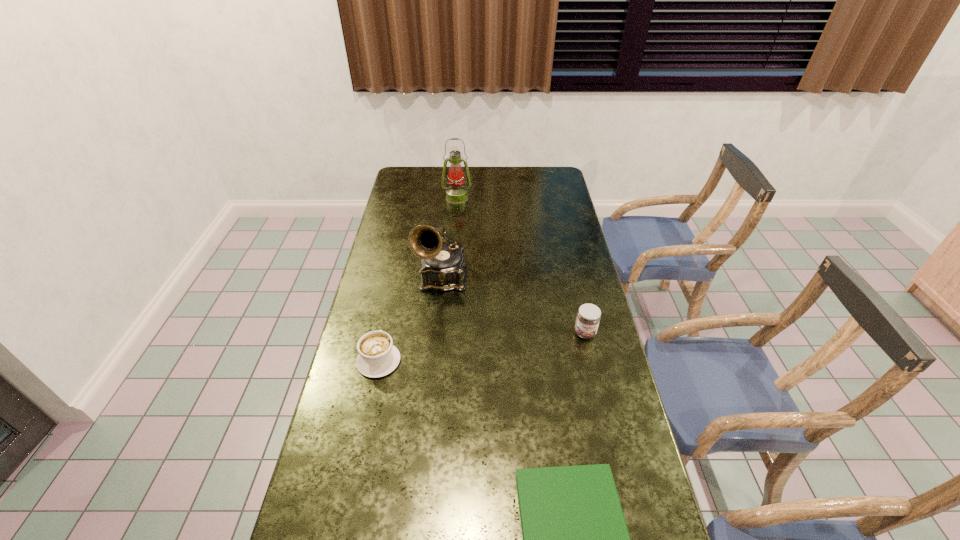
In order to click on free spot between the jam and the fourth nearest object in this screenshot , I will do 514,305.

Find the location of a particular element. free space between the jam and the oil lamp is located at coordinates (521, 266).

Locate an element on the screen. free space between the jam and the phonograph record is located at coordinates (514, 305).

This screenshot has width=960, height=540. I want to click on object that is the fourth closest to the farthest object, so click(575, 539).

Choose which object is the nearest neighbor to the leftmost object. Please provide its 2D coordinates. Your answer should be formatted as a tuple, i.e. [(x, y)], where the tuple contains the x and y coordinates of a point satisfying the conditions above.

[(443, 267)]

The height and width of the screenshot is (540, 960). I want to click on blank space that satisfies the following two spatial constraints: 1. to the right of the oil lamp's handle; 2. on the left side of the fourth farthest object, so click(x=413, y=198).

This screenshot has height=540, width=960. I want to click on vacant region that satisfies the following two spatial constraints: 1. to the right of the leftmost object's handle; 2. on the right side of the oil lamp, so 413,198.

At what (x,y) coordinates should I click in order to perform the action: click on free location that satisfies the following two spatial constraints: 1. to the right of the leftmost object's handle; 2. on the left side of the oil lamp. Please return your answer as a coordinate pair (x, y). This screenshot has height=540, width=960. Looking at the image, I should click on (413, 198).